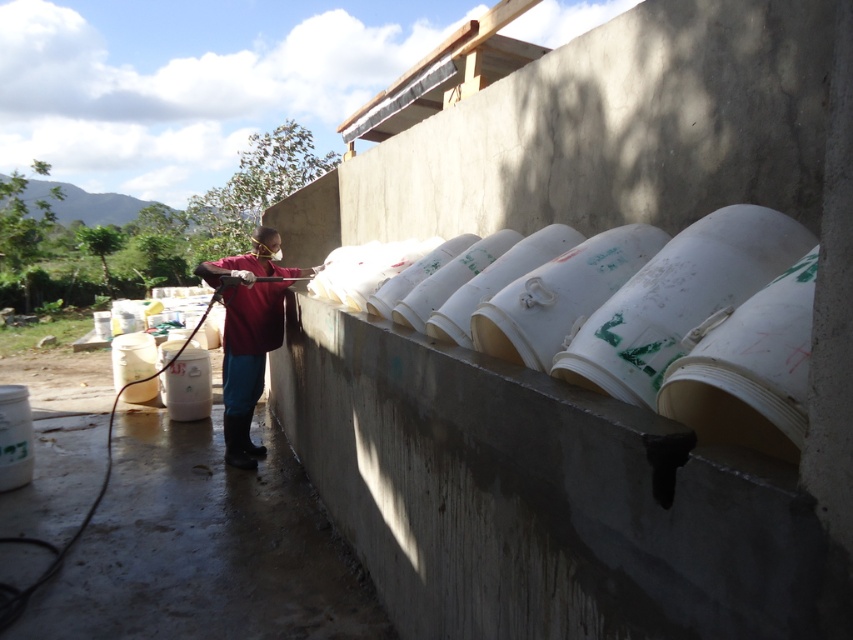
You are a maintenance worker standing on the smooth concrete floor at lower left. You need to place a heavy tool on the floor next to your matte red shirt at center. Will the floor have enough space to accommodate the tool?

The smooth concrete floor at lower left has a larger width than the matte red shirt at center, so there should be enough space to place the heavy tool next to the matte red shirt at center.

You are a maintenance worker standing on the smooth concrete floor at lower left, looking up at the matte red shirt at center. Which direction should you move to get closer to the person?

Since the smooth concrete floor at lower left is below the matte red shirt at center, you should move upward or forward to get closer to the person wearing the matte red shirt at center.